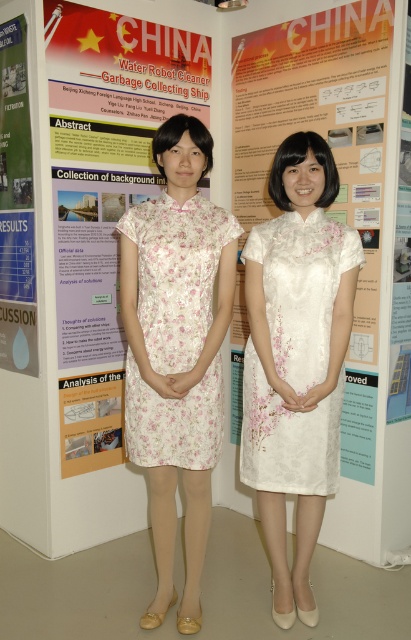
Does blue glossy poster at left lie in front of white paper poster at center?

Yes, blue glossy poster at left is closer to the viewer.

Can you confirm if blue glossy poster at left is thinner than white paper poster at center?

Correct, blue glossy poster at left's width is less than white paper poster at center's.

Image resolution: width=411 pixels, height=640 pixels. Find the location of `blue glossy poster at left`. blue glossy poster at left is located at coordinates (16, 205).

Is white floral dress at center bigger than white paper poster at center?

Yes, white floral dress at center is bigger than white paper poster at center.

Does white floral dress at center appear over white paper poster at center?

Yes, white floral dress at center is above white paper poster at center.

At what (x,y) coordinates should I click in order to perform the action: click on white floral dress at center. Please return your answer as a coordinate pair (x, y). Image resolution: width=411 pixels, height=640 pixels. Looking at the image, I should click on (302, 289).

Which of these two, white floral dress at center or blue glossy poster at left, stands shorter?

white floral dress at center is shorter.

Describe the element at coordinates (302, 289) in the screenshot. Image resolution: width=411 pixels, height=640 pixels. I see `white floral dress at center` at that location.

You are a GUI agent. You are given a task and a screenshot of the screen. Output one action in this format:
    pyautogui.click(x=<x>, y=<y>)
    Task: Click on the white floral dress at center
    
    Given the screenshot: What is the action you would take?
    pyautogui.click(x=302, y=289)